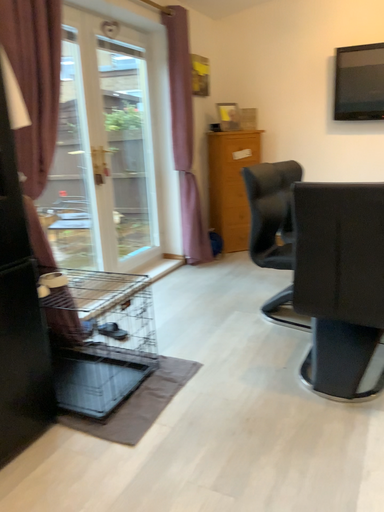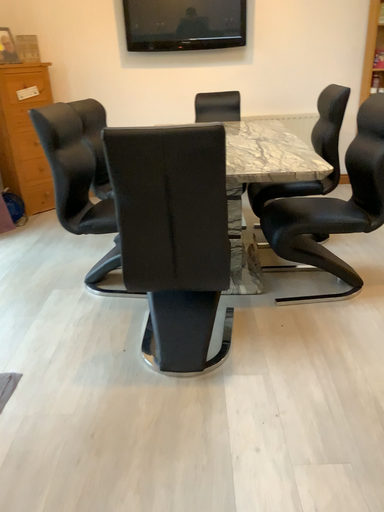
Question: Which way did the camera rotate in the video?

Choices:
 (A) rotated left
 (B) rotated right

Answer: (B)